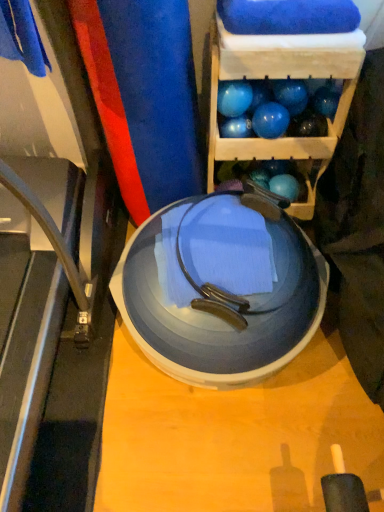
Question: Is blue rubber ball at upper center, which is the 2th ball from right to left, looking in the opposite direction of blue glossy bowling balls at upper right?

Choices:
 (A) no
 (B) yes

Answer: (B)

Question: Is blue rubber ball at upper center, which is the 2th ball from right to left, located outside blue glossy bowling balls at upper right?

Choices:
 (A) no
 (B) yes

Answer: (A)

Question: From the image's perspective, is blue rubber ball at upper center, which is counted as the third ball, starting from the left, beneath blue glossy bowling balls at upper right?

Choices:
 (A) no
 (B) yes

Answer: (B)

Question: Is the depth of blue rubber ball at upper center, which is the 2th ball from right to left, greater than that of blue glossy bowling balls at upper right?

Choices:
 (A) no
 (B) yes

Answer: (B)

Question: Is blue rubber ball at upper center, which is the 2th ball from right to left, next to blue glossy bowling balls at upper right and touching it?

Choices:
 (A) yes
 (B) no

Answer: (B)

Question: Can you confirm if blue rubber ball at upper center, which is the 2th ball from right to left, is shorter than blue glossy bowling balls at upper right?

Choices:
 (A) no
 (B) yes

Answer: (B)

Question: Is blue rubber balloon at upper right touching blue rubber ball at upper center, which is the 2th ball from right to left?

Choices:
 (A) yes
 (B) no

Answer: (B)

Question: Would you consider blue rubber balloon at upper right to be distant from blue rubber ball at upper center, which is counted as the third ball, starting from the left?

Choices:
 (A) no
 (B) yes

Answer: (A)

Question: From the image's perspective, is blue rubber balloon at upper right over blue rubber ball at upper center, which is the 2th ball from right to left?

Choices:
 (A) yes
 (B) no

Answer: (A)

Question: Does blue rubber balloon at upper right lie behind blue rubber ball at upper center, which is the 2th ball from right to left?

Choices:
 (A) yes
 (B) no

Answer: (A)

Question: Is blue rubber balloon at upper right positioned with its back to blue rubber ball at upper center, which is the 2th ball from right to left?

Choices:
 (A) no
 (B) yes

Answer: (A)

Question: Considering the relative sizes of blue rubber balloon at upper right and blue rubber ball at upper center, which is counted as the third ball, starting from the left, in the image provided, is blue rubber balloon at upper right shorter than blue rubber ball at upper center, which is counted as the third ball, starting from the left,?

Choices:
 (A) no
 (B) yes

Answer: (B)

Question: Is glossy blue ball at upper center, positioned as the third ball in right-to-left order, next to metallic gray treadmill at lower left?

Choices:
 (A) yes
 (B) no

Answer: (B)